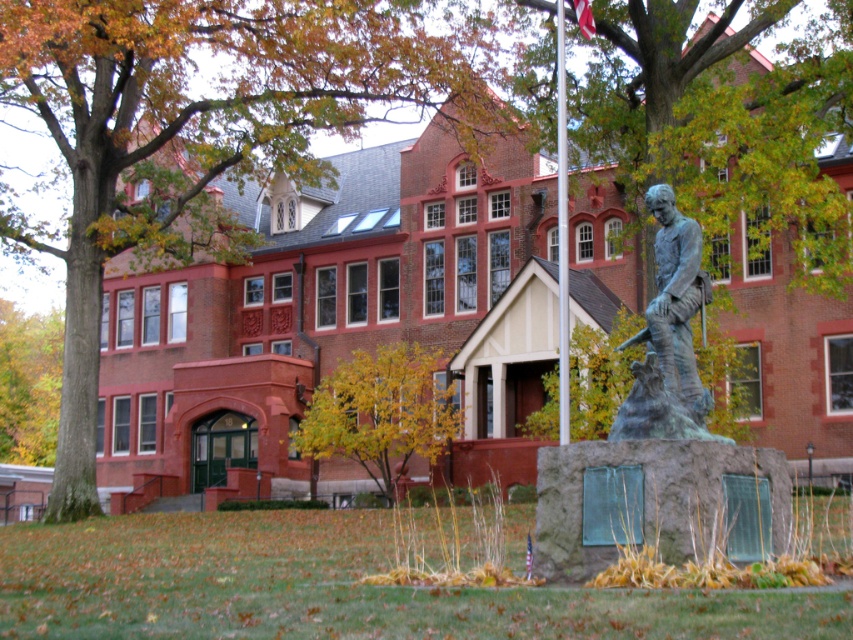
Question: Which object is farther from the camera taking this photo?

Choices:
 (A) metallic flagpole at center
 (B) yellow-green leaves at upper left
 (C) red fabric flag at upper center
 (D) yellow leafy tree at center

Answer: (B)

Question: Among these points, which one is nearest to the camera?

Choices:
 (A) (708, 300)
 (B) (4, 445)

Answer: (A)

Question: Can you confirm if yellow leafy tree at center is positioned to the left of red fabric flag at upper center?

Choices:
 (A) yes
 (B) no

Answer: (A)

Question: Which of the following is the closest to the observer?

Choices:
 (A) (47, 512)
 (B) (564, 291)
 (C) (583, 12)

Answer: (B)

Question: Can you confirm if metallic flagpole at center is positioned above red fabric flag at upper center?

Choices:
 (A) yes
 (B) no

Answer: (B)

Question: Does yellow leafy tree at center have a smaller size compared to yellow-green leaves at upper left?

Choices:
 (A) yes
 (B) no

Answer: (A)